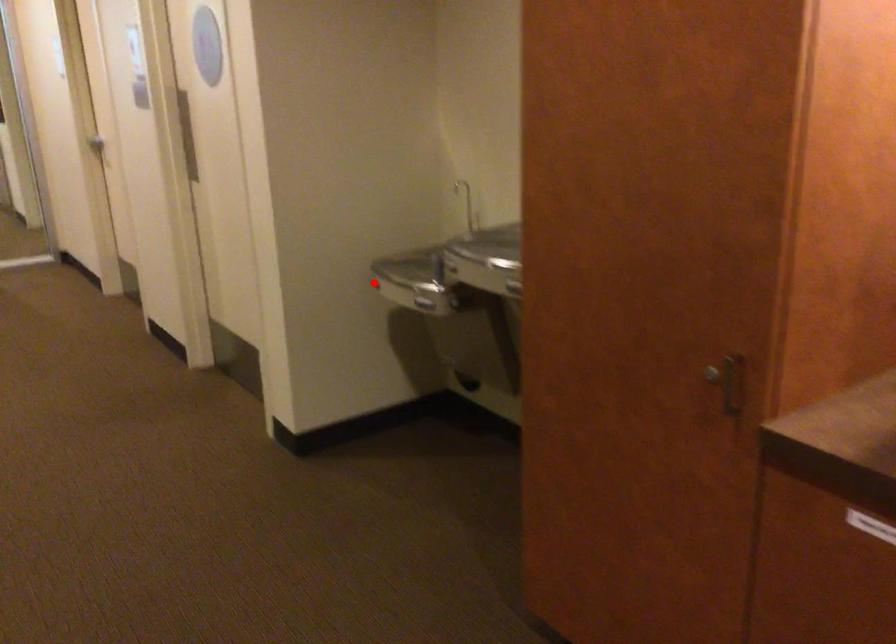
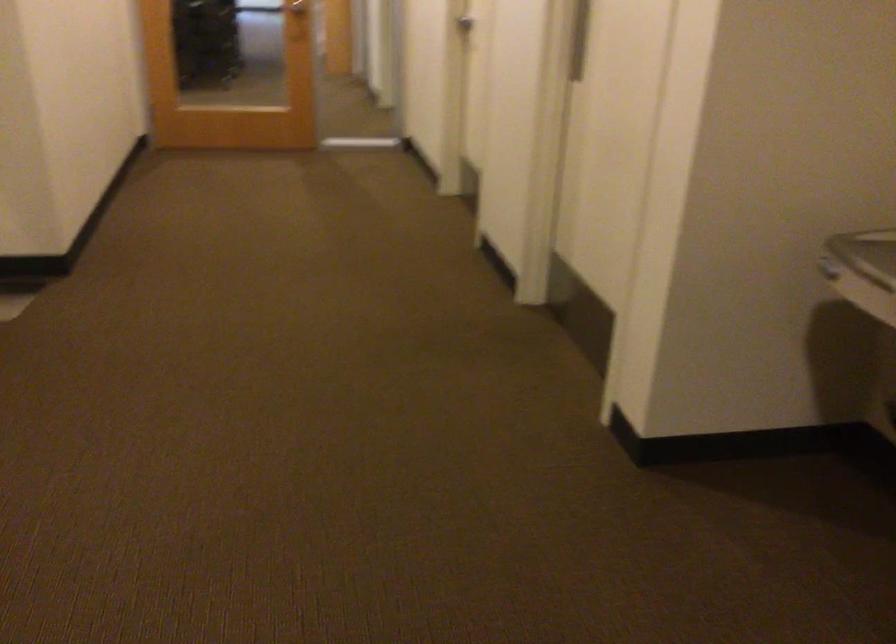
The point at the highlighted location is marked in the first image. Where is the corresponding point in the second image?

(829, 269)